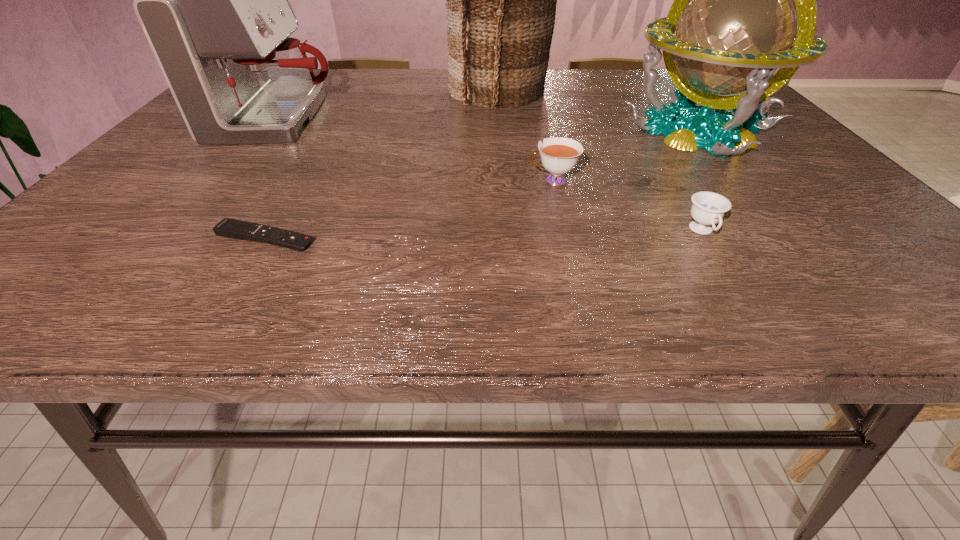
You are a GUI agent. You are given a task and a screenshot of the screen. Output one action in this format:
    pyautogui.click(x=<x>, y=<y>)
    Task: Click on the object situated at the far left corner
    
    Given the screenshot: What is the action you would take?
    pyautogui.click(x=212, y=0)

At what (x,y) coordinates should I click in order to perform the action: click on blank space at the far edge of the desktop. Please return your answer as a coordinate pair (x, y). Looking at the image, I should click on (448, 75).

Locate an element on the screen. free space at the near edge of the desktop is located at coordinates (774, 274).

Where is `vacant space at the left edge of the desktop`? The image size is (960, 540). vacant space at the left edge of the desktop is located at coordinates (x=149, y=238).

In the image, there is a desktop. At what (x,y) coordinates should I click in order to perform the action: click on vacant area at the right edge. Please return your answer as a coordinate pair (x, y). This screenshot has height=540, width=960. Looking at the image, I should click on (786, 150).

Locate an element on the screen. The height and width of the screenshot is (540, 960). empty space between the farther teacup and the shortest object is located at coordinates (409, 210).

The image size is (960, 540). Find the location of `vacant area that lies between the right teacup and the second tallest object`. vacant area that lies between the right teacup and the second tallest object is located at coordinates [701, 181].

Where is `free space between the tallest object and the third shortest object`? This screenshot has width=960, height=540. free space between the tallest object and the third shortest object is located at coordinates (526, 136).

Identify the location of unoccupied area between the coffee maker and the second tallest object. (490, 125).

Locate an element on the screen. The image size is (960, 540). vacant space that's between the third tallest object and the tallest object is located at coordinates (389, 105).